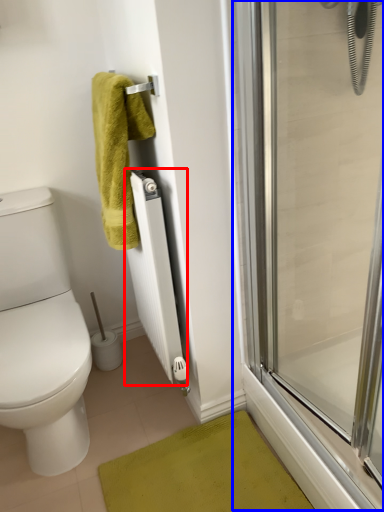
Question: Which point is closer to the camera, radiator (highlighted by a red box) or screen door (highlighted by a blue box)?

Choices:
 (A) radiator
 (B) screen door

Answer: (B)